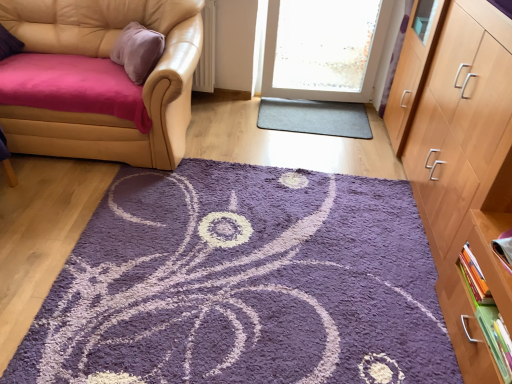
Question: Is hardcover book at right, the 2th book positioned from the top, wider or thinner than leather couch at left?

Choices:
 (A) wide
 (B) thin

Answer: (B)

Question: Considering the relative positions of hardcover book at right, which is counted as the second book, starting from the bottom, and leather couch at left in the image provided, is hardcover book at right, which is counted as the second book, starting from the bottom, to the left or to the right of leather couch at left?

Choices:
 (A) left
 (B) right

Answer: (B)

Question: Estimate the real-world distances between objects in this image. Which object is farther from the green matte book at lower right, which is counted as the first book, starting from the bottom?

Choices:
 (A) hardcover book at right, the 2th book positioned from the top
 (B) light brown wood cabinet at right
 (C) matte purple book at right, positioned as the 3th book in bottom-to-top order
 (D) purple shaggy rug at center
 (E) gray rubber mat at center

Answer: (E)

Question: Estimate the real-world distances between objects in this image. Which object is closer to the green matte book at lower right, which ranks as the 3th book in top-to-bottom order?

Choices:
 (A) gray rubber mat at center
 (B) hardcover book at right, which is counted as the second book, starting from the bottom
 (C) leather couch at left
 (D) light brown wood cabinet at right
 (E) matte purple book at right, positioned as the 3th book in bottom-to-top order

Answer: (B)